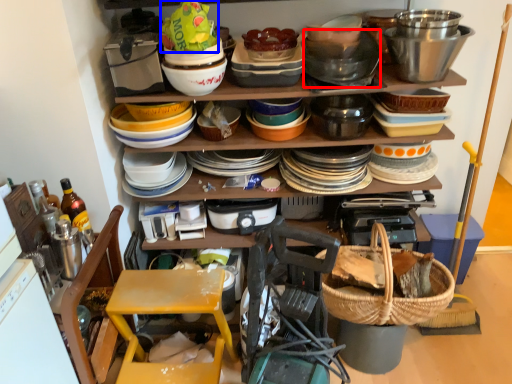
Question: Which object appears closest to the camera in this image, bucket (highlighted by a red box) or food (highlighted by a blue box)?

Choices:
 (A) bucket
 (B) food

Answer: (B)